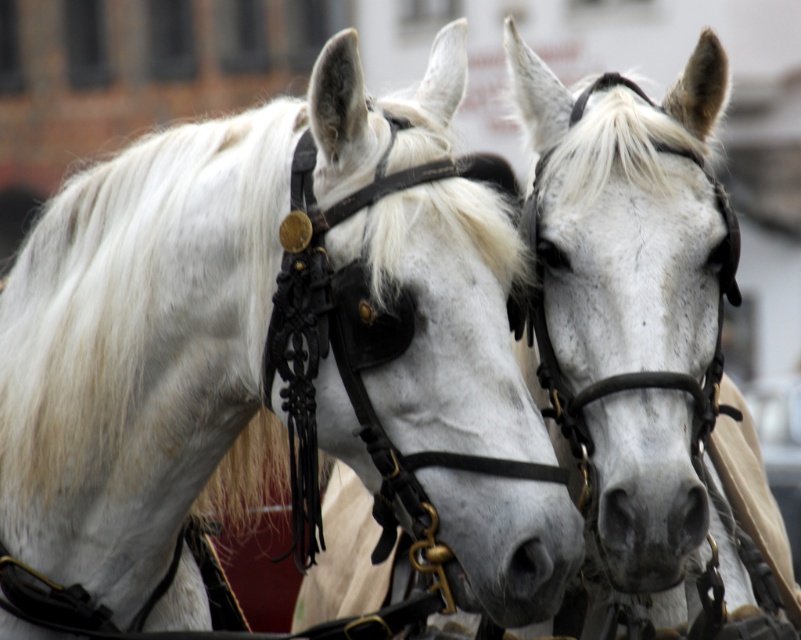
Question: Which point is farther to the camera?

Choices:
 (A) gray matte nose at center
 (B) white matte horse at center

Answer: (B)

Question: Does white matte horse at center appear over white leather bridle at center?

Choices:
 (A) yes
 (B) no

Answer: (B)

Question: Is white matte horse at center to the right of gray matte nose at center from the viewer's perspective?

Choices:
 (A) yes
 (B) no

Answer: (B)

Question: Which object is farther from the camera taking this photo?

Choices:
 (A) white matte horse at center
 (B) gray matte nose at center
 (C) white leather bridle at center

Answer: (C)

Question: Does white matte horse at center appear under white leather bridle at center?

Choices:
 (A) yes
 (B) no

Answer: (A)

Question: Estimate the real-world distances between objects in this image. Which object is closer to the white matte horse at center?

Choices:
 (A) gray matte nose at center
 (B) white leather bridle at center

Answer: (A)